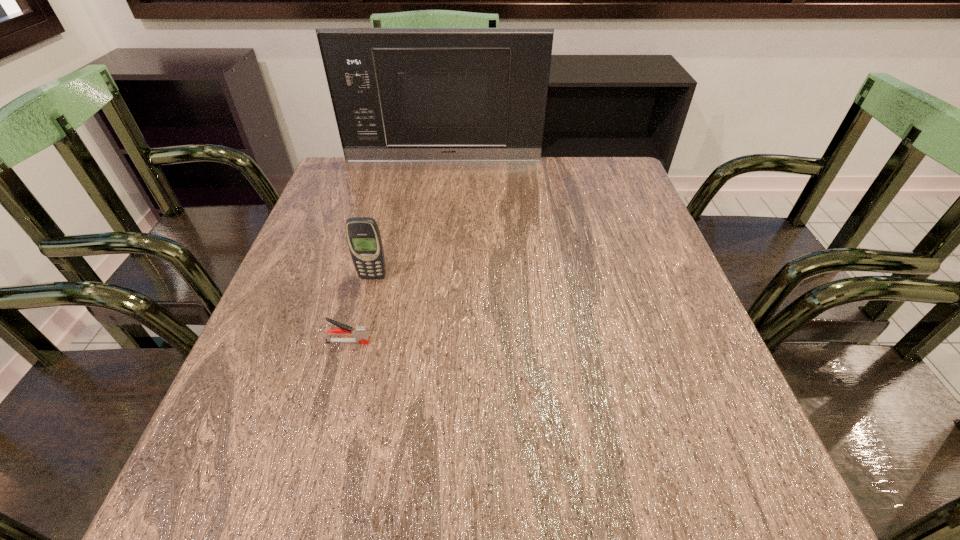
Locate an element on the screen. This screenshot has width=960, height=540. vacant region between the cellular telephone and the microwave oven is located at coordinates (408, 219).

Locate which object ranks second in proximity to the tallest object. Please provide its 2D coordinates. Your answer should be formatted as a tuple, i.e. [(x, y)], where the tuple contains the x and y coordinates of a point satisfying the conditions above.

[(360, 333)]

Image resolution: width=960 pixels, height=540 pixels. In order to click on object that is the second nearest to the stapler in this screenshot , I will do `click(399, 94)`.

Where is `vacant area that satisfies the following two spatial constraints: 1. on the front panel of the microwave oven; 2. on the handle side of the shortest object`? vacant area that satisfies the following two spatial constraints: 1. on the front panel of the microwave oven; 2. on the handle side of the shortest object is located at coordinates (421, 342).

Where is `vacant region that satisfies the following two spatial constraints: 1. on the screen of the second farthest object; 2. on the handle side of the nearest object`? vacant region that satisfies the following two spatial constraints: 1. on the screen of the second farthest object; 2. on the handle side of the nearest object is located at coordinates (356, 342).

Find the location of `free location that satisfies the following two spatial constraints: 1. on the screen of the cellular telephone; 2. on the handle side of the stapler`. free location that satisfies the following two spatial constraints: 1. on the screen of the cellular telephone; 2. on the handle side of the stapler is located at coordinates (356, 342).

Locate an element on the screen. This screenshot has height=540, width=960. free point that satisfies the following two spatial constraints: 1. on the screen of the second nearest object; 2. on the handle side of the shortest object is located at coordinates (356, 342).

Locate an element on the screen. vacant space that satisfies the following two spatial constraints: 1. on the front panel of the tallest object; 2. on the handle side of the stapler is located at coordinates (421, 342).

The height and width of the screenshot is (540, 960). Find the location of `free spot that satisfies the following two spatial constraints: 1. on the front panel of the tallest object; 2. on the handle side of the nearest object`. free spot that satisfies the following two spatial constraints: 1. on the front panel of the tallest object; 2. on the handle side of the nearest object is located at coordinates (421, 342).

Where is `vacant space that satisfies the following two spatial constraints: 1. on the screen of the cellular telephone; 2. on the handle side of the nearest object`? The height and width of the screenshot is (540, 960). vacant space that satisfies the following two spatial constraints: 1. on the screen of the cellular telephone; 2. on the handle side of the nearest object is located at coordinates (356, 342).